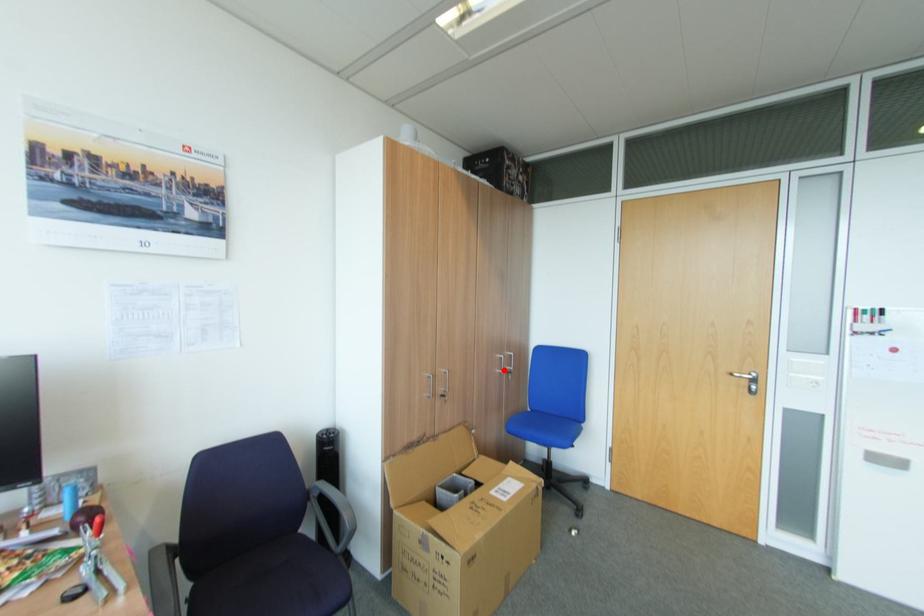
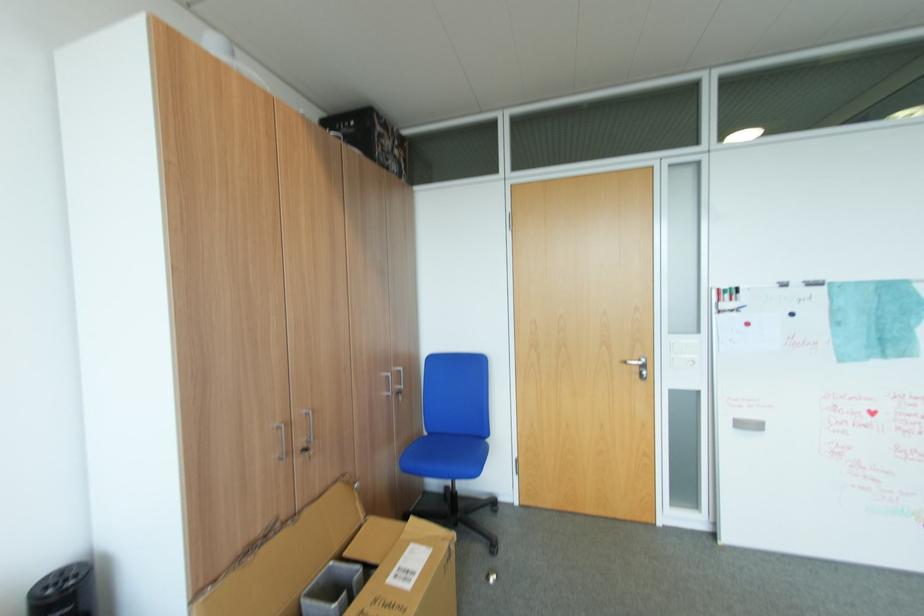
Locate, in the second image, the point that corresponds to the highlighted location in the first image.

(390, 394)